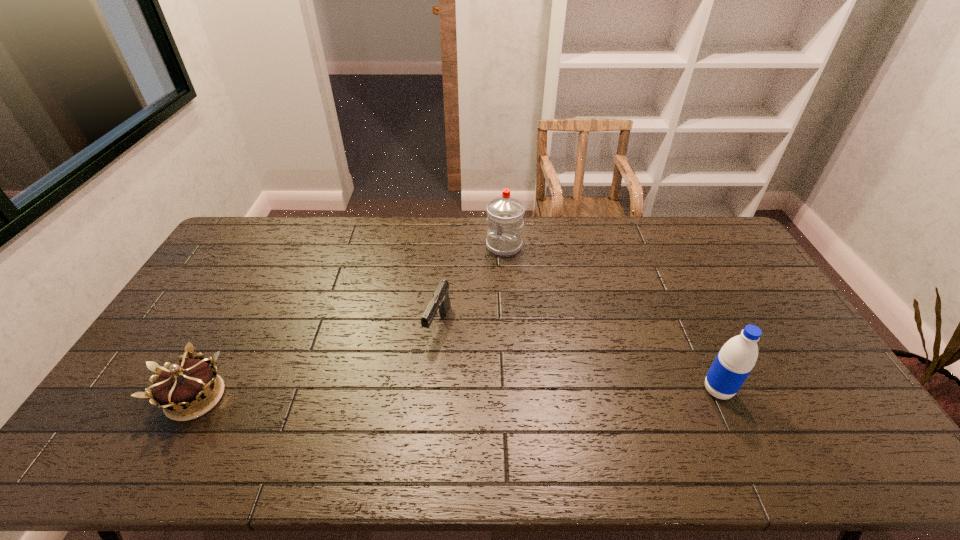
Where is `free space between the pistol and the nearer water bottle`? This screenshot has height=540, width=960. free space between the pistol and the nearer water bottle is located at coordinates (578, 357).

Find the location of a particular element. free area in between the leftmost object and the second farthest object is located at coordinates (317, 361).

Where is `empty location between the second farthest object and the leftmost object`? empty location between the second farthest object and the leftmost object is located at coordinates (317, 361).

Find the location of a particular element. vacant space in between the leftmost object and the nearer water bottle is located at coordinates (457, 394).

You are a GUI agent. You are given a task and a screenshot of the screen. Output one action in this format:
    pyautogui.click(x=<x>, y=<y>)
    Task: Click on the free point between the nearer water bottle and the second object from left to right
    Image resolution: width=960 pixels, height=540 pixels.
    Given the screenshot: What is the action you would take?
    tap(578, 357)

Identify the location of object that is the closest to the pistol. (505, 214).

Identify which object is the second nearest to the pistol. Please provide its 2D coordinates. Your answer should be formatted as a tuple, i.e. [(x, y)], where the tuple contains the x and y coordinates of a point satisfying the conditions above.

[(189, 384)]

The width and height of the screenshot is (960, 540). In order to click on free space that satisfies the following two spatial constraints: 1. on the front side of the rightmost object; 2. on the right side of the second farthest object in this screenshot , I will do `click(432, 390)`.